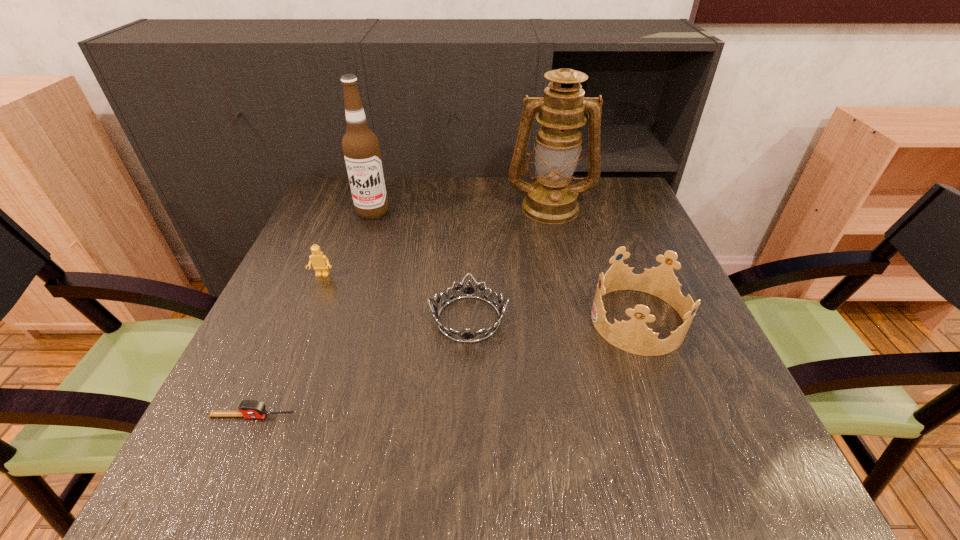
Where is `oil lamp`? oil lamp is located at coordinates (551, 199).

Locate an element on the screen. The height and width of the screenshot is (540, 960). alcohol is located at coordinates (361, 149).

This screenshot has height=540, width=960. In order to click on the third tallest object in this screenshot , I will do `click(633, 336)`.

This screenshot has width=960, height=540. What are the coordinates of `the taller tiara` in the screenshot? It's located at (633, 336).

Find the location of a particular element. The height and width of the screenshot is (540, 960). the fourth tallest object is located at coordinates (319, 261).

The image size is (960, 540). Identify the location of the third farthest object. (319, 261).

The width and height of the screenshot is (960, 540). Identify the location of the fourth object from left to right. (467, 337).

Identify the location of the shorter tiara. This screenshot has width=960, height=540. (467, 337).

Find the location of `the shortest object`. the shortest object is located at coordinates (249, 409).

Where is `tape measure`? The height and width of the screenshot is (540, 960). tape measure is located at coordinates (249, 409).